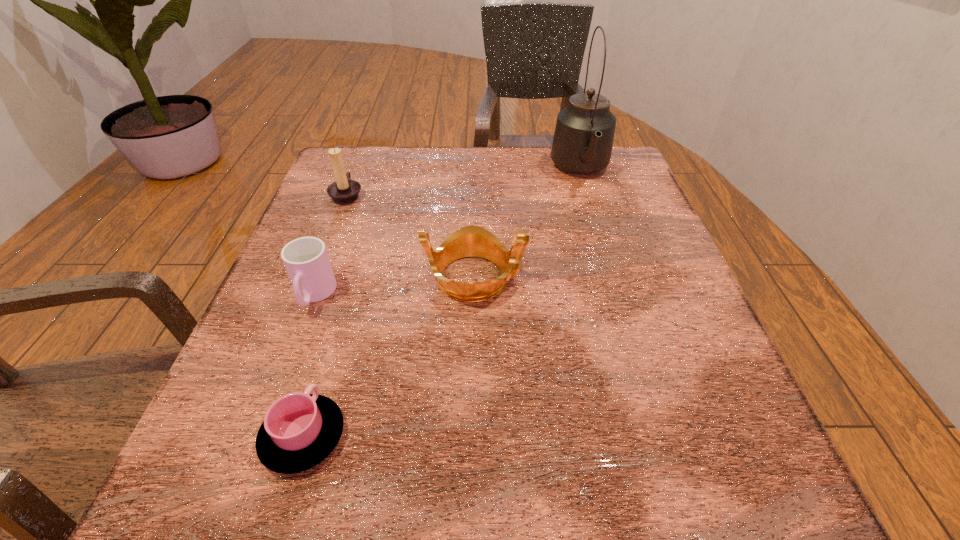
Locate an element on the screen. This screenshot has width=960, height=540. the tallest object is located at coordinates (583, 139).

The height and width of the screenshot is (540, 960). I want to click on kettle, so click(583, 139).

Where is `candle holder`? candle holder is located at coordinates (344, 190).

The width and height of the screenshot is (960, 540). I want to click on the fourth object from left to right, so click(470, 241).

Where is `the second shortest object`? the second shortest object is located at coordinates (306, 260).

Where is `the taller cup`? The height and width of the screenshot is (540, 960). the taller cup is located at coordinates (306, 260).

Where is `the nearest object`? The image size is (960, 540). the nearest object is located at coordinates (300, 430).

At what (x,y) coordinates should I click in order to perform the action: click on the shortest object. Please return your answer as a coordinate pair (x, y). The height and width of the screenshot is (540, 960). Looking at the image, I should click on (300, 430).

Find the location of a particular element. The height and width of the screenshot is (540, 960). vacant space situated 0.370m spout on the rightmost object is located at coordinates (626, 315).

You are a GUI agent. You are given a task and a screenshot of the screen. Output one action in this format:
    pyautogui.click(x=<x>, y=<y>)
    Task: Click on the vacant space situated 0.320m on the wick of the candle holder
    This screenshot has width=960, height=540.
    Given the screenshot: What is the action you would take?
    pyautogui.click(x=502, y=194)